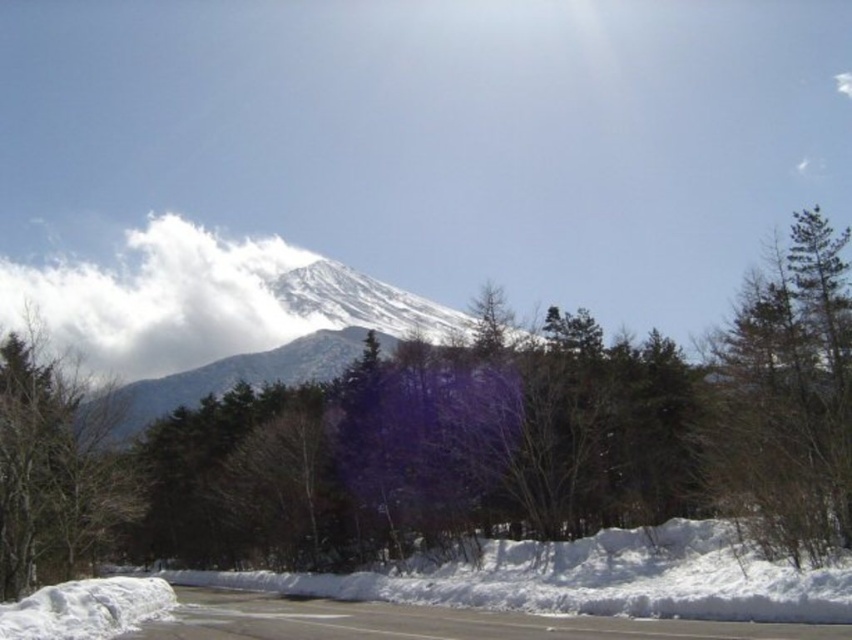
Does point (775, 472) lie behind point (85, 420)?

No.

Between point (787, 387) and point (79, 472), which one is positioned behind?

Positioned behind is point (79, 472).

Does point (751, 432) come behind point (33, 372)?

No, it is in front of (33, 372).

Locate an element on the screen. The height and width of the screenshot is (640, 852). green matte tree at right is located at coordinates (786, 401).

Does white fluffy cloud at upper center lie in front of green matte tree at left?

No, it is not.

Locate an element on the screen. The height and width of the screenshot is (640, 852). white fluffy cloud at upper center is located at coordinates (160, 300).

Where is `white fluffy cloud at upper center`? This screenshot has width=852, height=640. white fluffy cloud at upper center is located at coordinates (160, 300).

The height and width of the screenshot is (640, 852). Find the location of `white fluffy cloud at upper center`. white fluffy cloud at upper center is located at coordinates [160, 300].

Between point (62, 444) and point (229, 371), which one is positioned behind?

The point (229, 371) is behind.

Between green matte tree at left and white snow-covered mountain at center, which one appears on the left side from the viewer's perspective?

green matte tree at left is more to the left.

Which is in front, point (26, 572) or point (456, 332)?

Point (26, 572) is more forward.

The width and height of the screenshot is (852, 640). What are the coordinates of `green matte tree at left` in the screenshot? It's located at (55, 467).